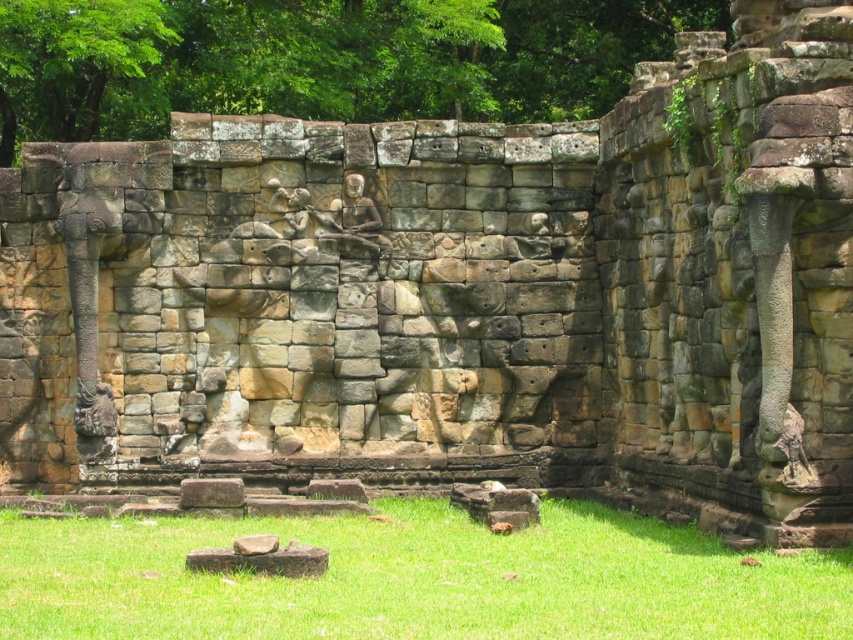
Question: Does green grass at lower center have a larger size compared to brown stone elephant at left?

Choices:
 (A) no
 (B) yes

Answer: (A)

Question: Is green grass at lower center above brown stone elephant at left?

Choices:
 (A) yes
 (B) no

Answer: (B)

Question: Does brown stone elephant at left appear over rustic stone carving at center?

Choices:
 (A) yes
 (B) no

Answer: (A)

Question: Which point is farther to the camera?

Choices:
 (A) brown stone elephant at left
 (B) green grass at lower center
 (C) rustic stone carving at center
 (D) brown rough stone at center

Answer: (C)

Question: Which is farther from the rustic stone carving at center?

Choices:
 (A) brown stone elephant at left
 (B) green grass at lower center

Answer: (B)

Question: Which point is farther to the camera?

Choices:
 (A) rustic stone carving at center
 (B) brown stone elephant at left

Answer: (A)